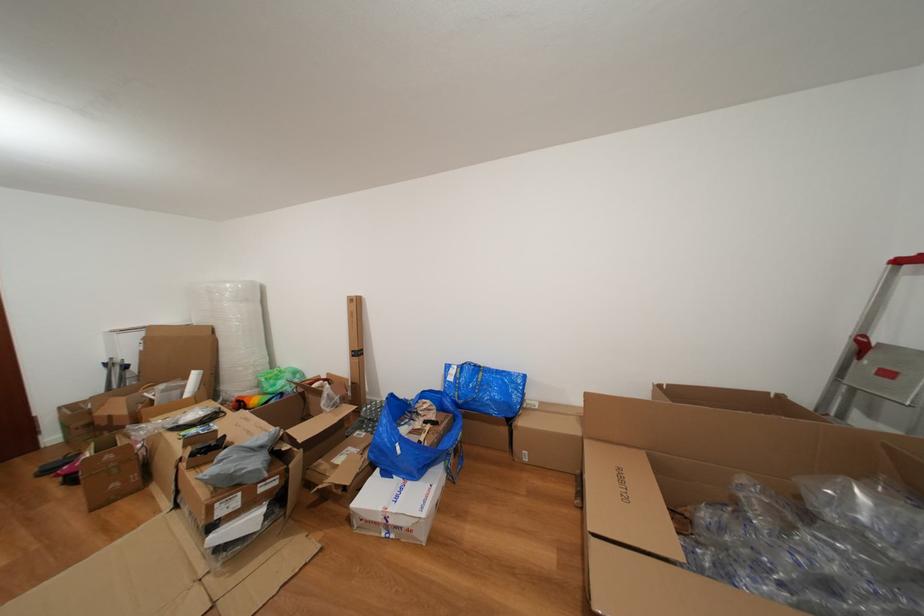
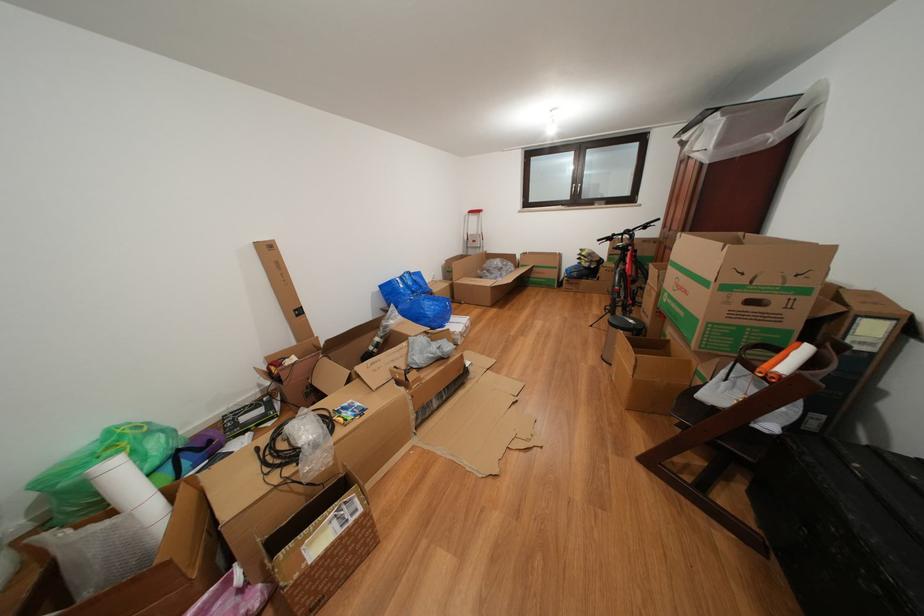
Locate, in the second image, the point that corresponds to (x=458, y=384) in the first image.

(409, 291)